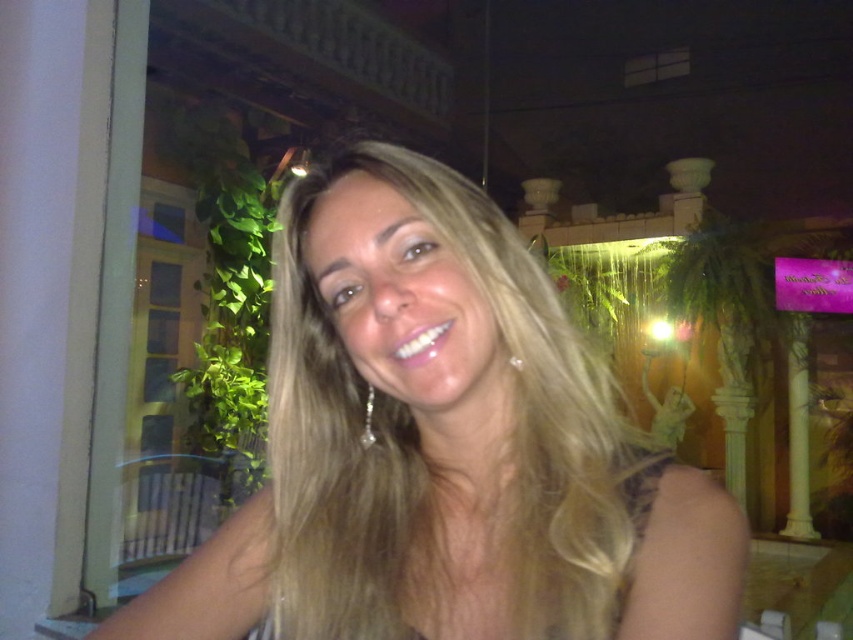
Question: Which point appears farthest from the camera in this image?

Choices:
 (A) (622, 496)
 (B) (604, 433)

Answer: (B)

Question: Does blonde hair at center appear on the left side of silky blonde hair at center?

Choices:
 (A) yes
 (B) no

Answer: (A)

Question: Which point appears closest to the camera in this image?

Choices:
 (A) (471, 227)
 (B) (631, 538)

Answer: (B)

Question: Does blonde hair at center have a lesser width compared to silky blonde hair at center?

Choices:
 (A) yes
 (B) no

Answer: (B)

Question: Does blonde hair at center have a larger size compared to silky blonde hair at center?

Choices:
 (A) yes
 (B) no

Answer: (A)